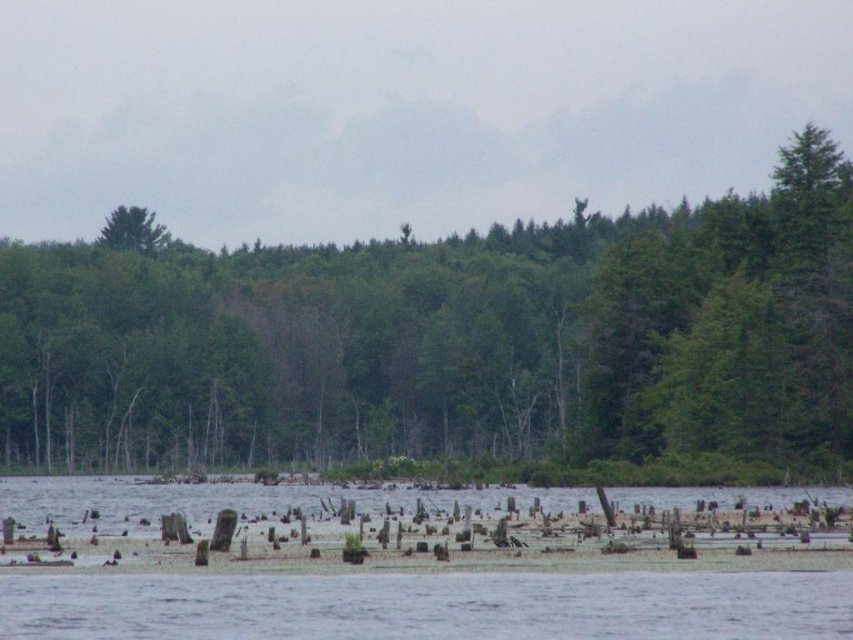
In the scene shown: Does transparent water at lower center have a larger size compared to green matte tree at upper left?

No, transparent water at lower center is not bigger than green matte tree at upper left.

Is transparent water at lower center thinner than green matte tree at upper left?

Indeed, transparent water at lower center has a lesser width compared to green matte tree at upper left.

Does point (849, 586) come in front of point (142, 252)?

Yes.

I want to click on transparent water at lower center, so click(x=428, y=605).

The width and height of the screenshot is (853, 640). Describe the element at coordinates (454, 344) in the screenshot. I see `green matte tree at center` at that location.

Who is positioned more to the right, green matte tree at center or green matte tree at upper left?

green matte tree at center

Which is in front, point (822, 404) or point (161, 243)?

Point (822, 404)

The height and width of the screenshot is (640, 853). I want to click on green matte tree at center, so click(x=454, y=344).

Is point (55, 278) positioned before point (695, 628)?

That is False.

Between green matte tree at center and transparent water at lower center, which one has more height?

Standing taller between the two is green matte tree at center.

In order to click on green matte tree at center in this screenshot , I will do `click(454, 344)`.